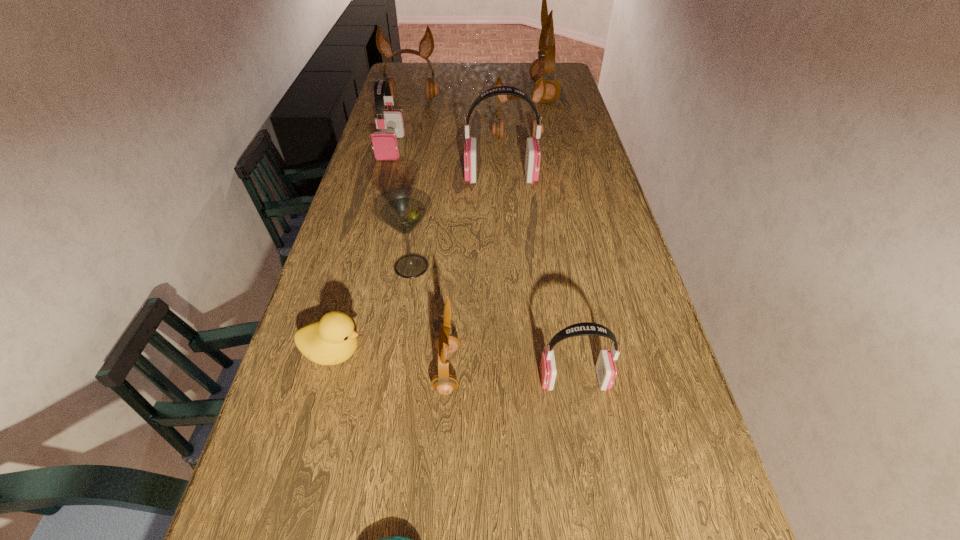
The width and height of the screenshot is (960, 540). I want to click on free region located 0.110m on the front-facing side of the second smallest brown earphone, so click(x=519, y=159).

Find the location of a particular element. This screenshot has width=960, height=540. vacant space located on the outer surface of the second biggest pink earphone is located at coordinates (376, 201).

This screenshot has height=540, width=960. Find the location of `vacant region located 0.170m on the left of the sixth farthest object`. vacant region located 0.170m on the left of the sixth farthest object is located at coordinates (322, 266).

At what (x,y) coordinates should I click in order to perform the action: click on vacant space located 0.350m on the front-facing side of the second brown earphone from left to right. Please return your answer as a coordinate pair (x, y). Looking at the image, I should click on (620, 370).

This screenshot has height=540, width=960. Find the location of `free space located on the outer surface of the smallest pink earphone`. free space located on the outer surface of the smallest pink earphone is located at coordinates (424, 380).

The width and height of the screenshot is (960, 540). Identify the location of free spot located 0.260m on the outer surface of the smallest pink earphone. (420, 380).

Find the location of a particular element. This screenshot has width=960, height=540. free spot located 0.110m on the outer surface of the smallest pink earphone is located at coordinates (490, 380).

This screenshot has width=960, height=540. Find the location of `free region located on the front-facing side of the ninth tallest object`. free region located on the front-facing side of the ninth tallest object is located at coordinates (470, 353).

Find the location of a particular element. object present at the far edge is located at coordinates (544, 65).

What are the coordinates of `duck at the left edge` in the screenshot? It's located at (332, 340).